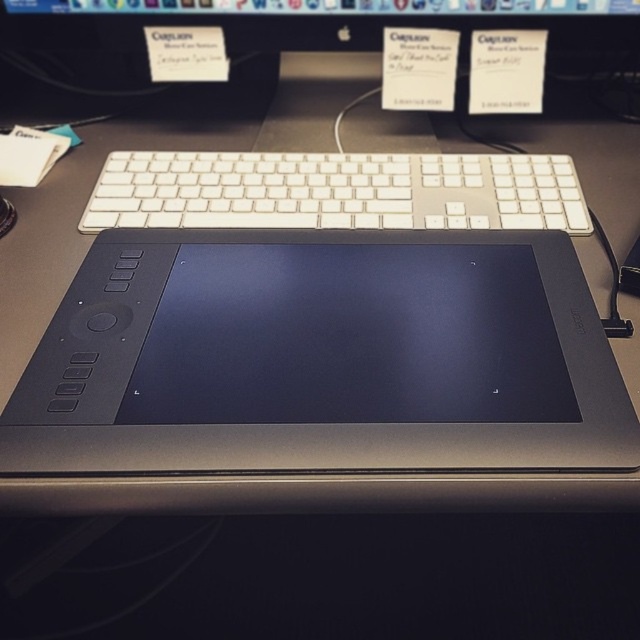
Question: Does white plastic keyboard at upper center appear on the left side of black plastic computer monitor at upper center?

Choices:
 (A) no
 (B) yes

Answer: (A)

Question: Is white plastic keyboard at upper center bigger than black plastic computer monitor at upper center?

Choices:
 (A) no
 (B) yes

Answer: (A)

Question: Which point is closer to the camera taking this photo?

Choices:
 (A) (483, 211)
 (B) (496, 6)
 (C) (449, 336)

Answer: (C)

Question: Observing the image, what is the correct spatial positioning of white plastic keyboard at upper center in reference to black plastic computer monitor at upper center?

Choices:
 (A) left
 (B) right

Answer: (B)

Question: Which point is farther to the camera?

Choices:
 (A) black matte tablet at center
 (B) white plastic keyboard at upper center

Answer: (B)

Question: Which object is the farthest from the white plastic keyboard at upper center?

Choices:
 (A) black matte tablet at center
 (B) black plastic computer monitor at upper center

Answer: (B)